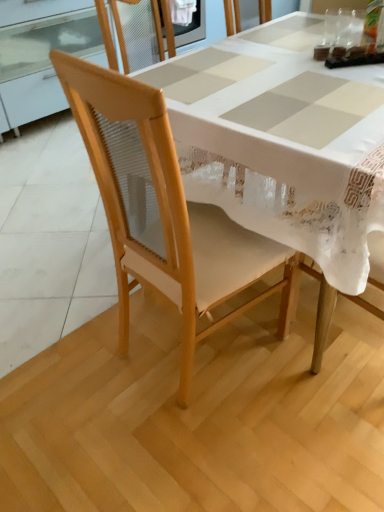
Where is `free area below natural wood chair at center (from a real-world perspective)`? The image size is (384, 512). free area below natural wood chair at center (from a real-world perspective) is located at coordinates (180, 353).